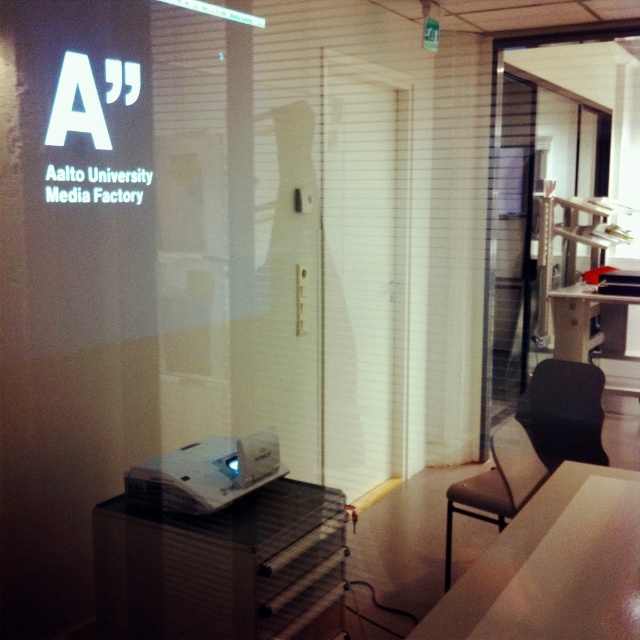
You are setting up equipment for a presentation in the Aalto University Media Factory. You have a white plastic projector at lower center and a glossy plastic table at center. Which object is shorter?

The white plastic projector at lower center is shorter than the glossy plastic table at center.

You are standing in the media production space at Aalto University Media Factory. You need to locate the transparent glass door. According to the image, where is the transparent glass door located relative to the point marked at coordinates (556, 180)?

The transparent glass door is located at the coordinates marked by point (556, 180).